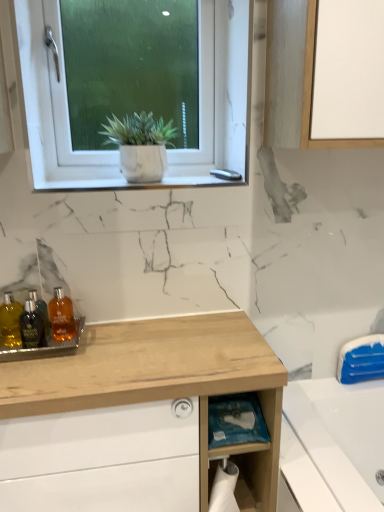
Question: In the image, is blue plastic bag at lower center positioned in front of or behind translucent amber bottle at center, placed as the third toiletry when sorted from left to right?

Choices:
 (A) front
 (B) behind

Answer: (A)

Question: Based on their positions, is blue plastic bag at lower center located to the left or right of translucent amber bottle at center, placed as the first toiletry when sorted from right to left?

Choices:
 (A) left
 (B) right

Answer: (B)

Question: Estimate the real-world distances between objects in this image. Which object is farther from the white marble window sill at upper center?

Choices:
 (A) translucent plastic bottles at lower left, which ranks as the second toiletry in left-to-right order
 (B) translucent amber bottle at lower left
 (C) translucent amber bottle at center, placed as the third toiletry when sorted from left to right
 (D) shiny glass bottles at left, the first toiletry in the left-to-right sequence
 (E) wooden cabinet at lower left

Answer: (E)

Question: Based on their relative distances, which object is farther from the shiny glass bottles at left, the 3th toiletry when ordered from right to left?

Choices:
 (A) translucent amber bottle at lower left
 (B) white matte window at upper center
 (C) translucent amber bottle at center, placed as the third toiletry when sorted from left to right
 (D) wooden cabinet at lower left
 (E) white marble plant pot at upper center

Answer: (B)